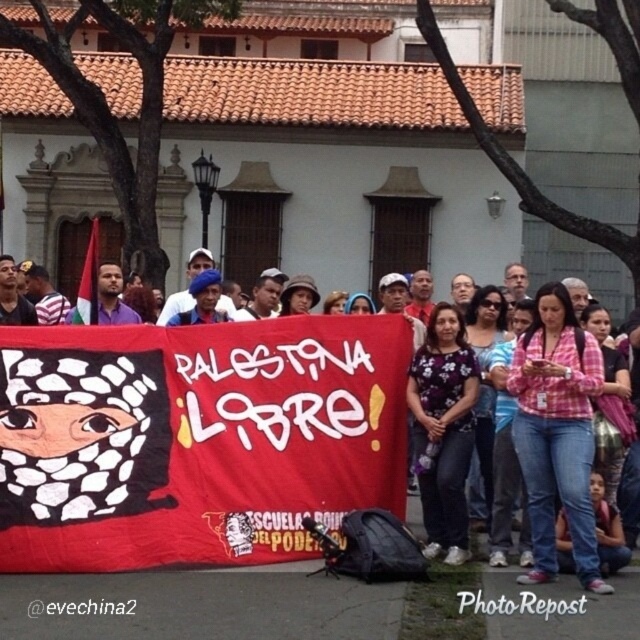
Question: Is pink plaid shirt at center to the left of pink checkered shirt at center from the viewer's perspective?

Choices:
 (A) no
 (B) yes

Answer: (B)

Question: Which point is closer to the camera?

Choices:
 (A) red fabric banner at center
 (B) pink checkered shirt at center

Answer: (A)

Question: Does pink checkered shirt at center lie in front of purple floral shirt at center?

Choices:
 (A) yes
 (B) no

Answer: (A)

Question: Does red fabric banner at center appear on the right side of purple floral shirt at center?

Choices:
 (A) no
 (B) yes

Answer: (A)

Question: Considering the real-world distances, which object is closest to the purple floral shirt at center?

Choices:
 (A) pink checkered shirt at center
 (B) pink plaid shirt at center
 (C) red fabric banner at center

Answer: (B)

Question: Which of the following is the farthest from the observer?

Choices:
 (A) purple floral shirt at center
 (B) pink checkered shirt at center

Answer: (A)